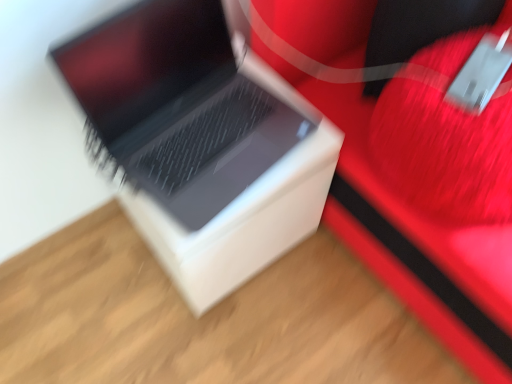
Identify the location of free space above white matte cardboard box at center (from a real-world perspective). (212, 133).